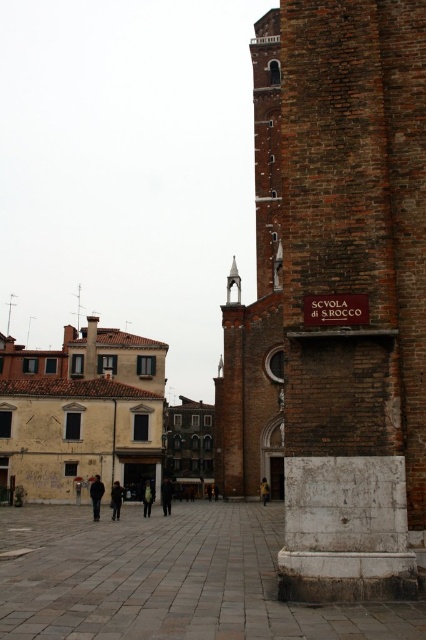
You are a tourist standing in the square and want to take a photo of the brown brick bell tower at upper right and the green fabric jacket at center. Which object will appear larger in the photo?

The brown brick bell tower at upper right will appear larger in the photo because it is taller than the green fabric jacket at center.

You are standing in the historic square and want to take a photo of the brown brick bell tower at upper right. Based on its location coordinates, where should you position yourself to ensure it fits in the frame?

The brown brick bell tower at upper right is located at coordinates point (267, 148), so you should position yourself to the left side of the square to capture it within your camera frame.